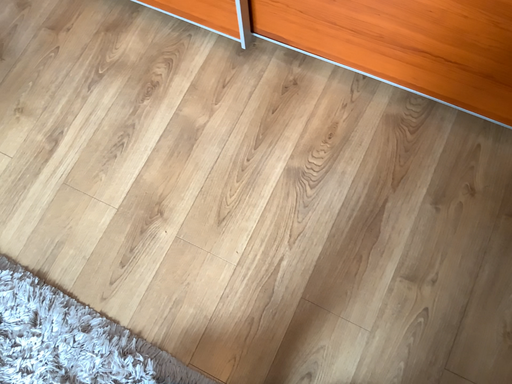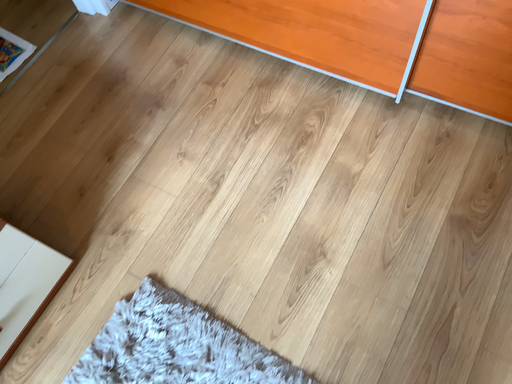
Question: Which way did the camera rotate in the video?

Choices:
 (A) rotated upward
 (B) rotated downward

Answer: (A)